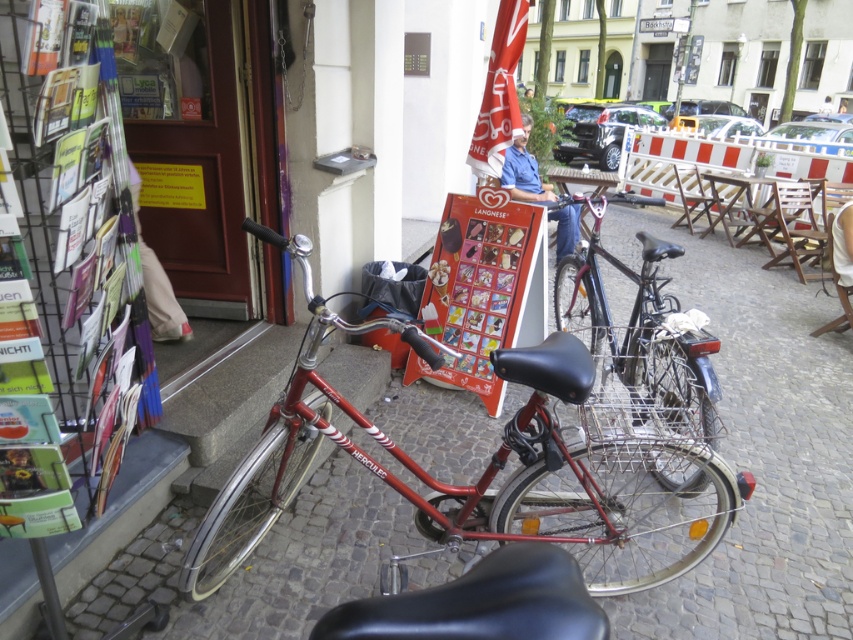
Question: Which point is closer to the camera taking this photo?

Choices:
 (A) (525, 436)
 (B) (654, 353)

Answer: (A)

Question: Is shiny red bicycle at center wider than shiny metallic bicycle at center?

Choices:
 (A) yes
 (B) no

Answer: (A)

Question: Is shiny red bicycle at center thinner than shiny metallic bicycle at center?

Choices:
 (A) no
 (B) yes

Answer: (A)

Question: Is the position of shiny red bicycle at center less distant than that of shiny metallic bicycle at center?

Choices:
 (A) yes
 (B) no

Answer: (A)